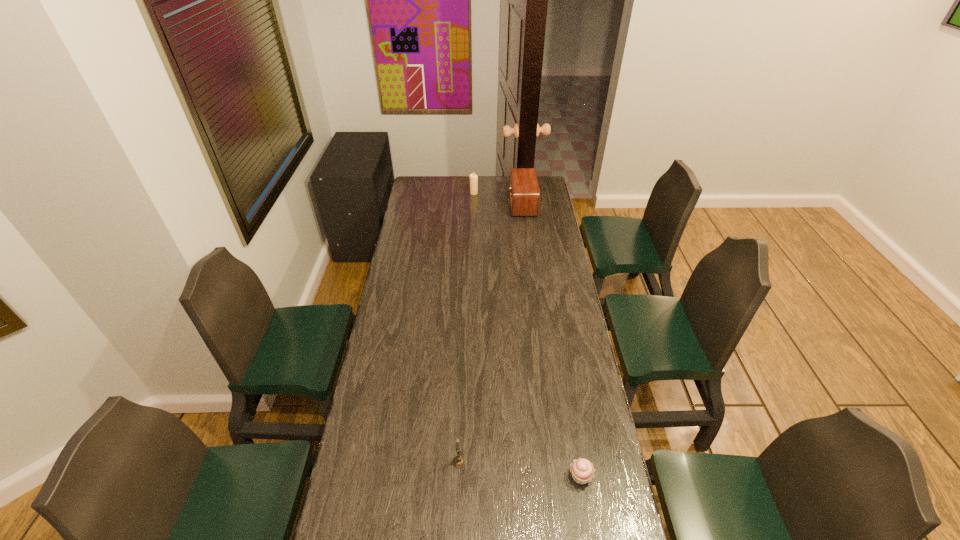
Where is `radio receiver`? The height and width of the screenshot is (540, 960). radio receiver is located at coordinates (524, 193).

Where is `the farther candle`? The image size is (960, 540). the farther candle is located at coordinates (473, 177).

Locate an element on the screen. the nearer candle is located at coordinates (459, 461).

Where is `the shortest object`? This screenshot has width=960, height=540. the shortest object is located at coordinates (582, 470).

At what (x,y) coordinates should I click in order to perform the action: click on free location located 0.120m on the front panel of the radio receiver. Please return your answer as a coordinate pair (x, y). The image size is (960, 540). Looking at the image, I should click on (489, 204).

In order to click on free space located on the front panel of the radio receiver in this screenshot , I will do `click(491, 204)`.

Image resolution: width=960 pixels, height=540 pixels. In order to click on vacant space located on the front panel of the radio receiver in this screenshot , I will do `click(459, 204)`.

Image resolution: width=960 pixels, height=540 pixels. Identify the location of vacant area situated on the front of the farther candle. (473, 228).

Find the location of `vacant space situated 0.290m on the right of the nearer candle`. vacant space situated 0.290m on the right of the nearer candle is located at coordinates (558, 462).

Locate an element on the screen. The width and height of the screenshot is (960, 540). vacant space situated 0.370m on the back of the shortest object is located at coordinates (563, 367).